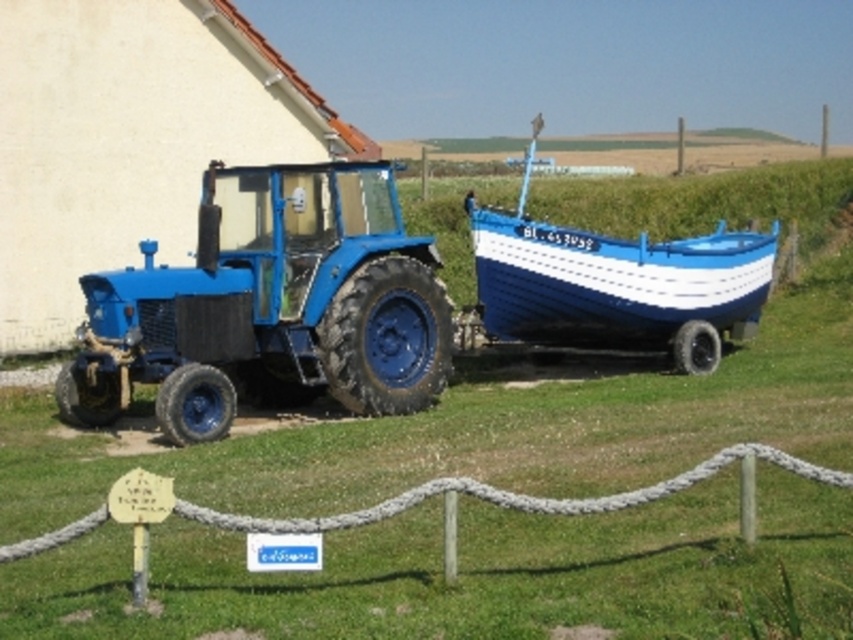
Question: Does matte blue tractor at left lie behind blue painted wood boat at right?

Choices:
 (A) yes
 (B) no

Answer: (B)

Question: Does matte blue tractor at left have a larger size compared to blue painted wood boat at right?

Choices:
 (A) no
 (B) yes

Answer: (A)

Question: Can you confirm if matte blue tractor at left is positioned to the right of blue painted wood boat at right?

Choices:
 (A) yes
 (B) no

Answer: (B)